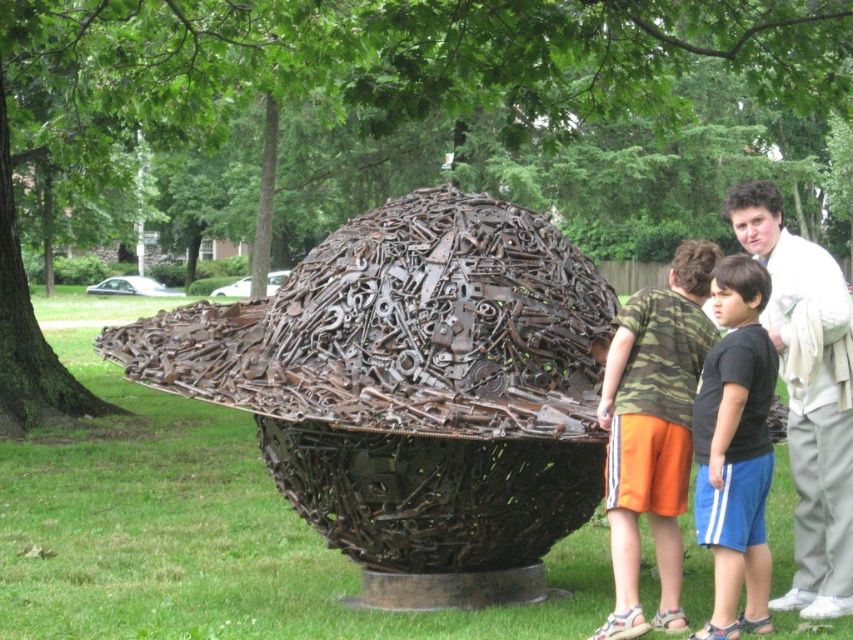
Question: Is white cotton shirt at right smaller than camo fabric shorts at lower center?

Choices:
 (A) no
 (B) yes

Answer: (A)

Question: Does camo fabric shorts at lower center appear over black cotton shirt at center?

Choices:
 (A) yes
 (B) no

Answer: (A)

Question: Which point is closer to the camera?

Choices:
 (A) black cotton shirt at center
 (B) camo fabric shorts at lower center
 (C) white cotton shirt at right

Answer: (B)

Question: Which is farther from the camo fabric shorts at lower center?

Choices:
 (A) white cotton shirt at right
 (B) rusty metal sphere at center
 (C) black cotton shirt at center

Answer: (B)

Question: Estimate the real-world distances between objects in this image. Which object is farther from the white cotton shirt at right?

Choices:
 (A) black cotton shirt at center
 (B) camo fabric shorts at lower center

Answer: (B)

Question: Is rusty metal sphere at center above camo fabric shorts at lower center?

Choices:
 (A) yes
 (B) no

Answer: (A)